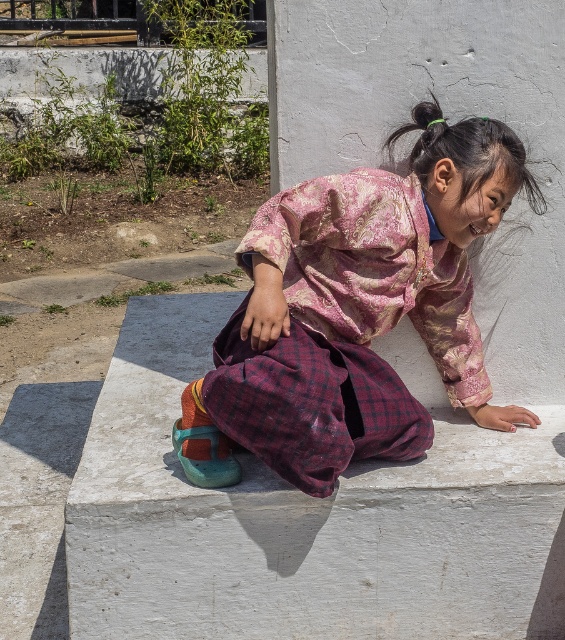
Does plaid fabric pants at center have a lesser width compared to white smooth concrete at center?

No, plaid fabric pants at center is not thinner than white smooth concrete at center.

Does plaid fabric pants at center have a greater height compared to white smooth concrete at center?

No.

Is point (224, 458) closer to viewer compared to point (475, 90)?

Yes, it is.

At what (x,y) coordinates should I click in order to perform the action: click on plaid fabric pants at center. Please return your answer as a coordinate pair (x, y). The width and height of the screenshot is (565, 640). Looking at the image, I should click on point(355,310).

Does white concrete at center appear on the left side of plaid fabric pants at center?

Yes, white concrete at center is to the left of plaid fabric pants at center.

Who is more forward, (459, 557) or (380, 244)?

Positioned in front is point (380, 244).

Looking at this image, measure the distance between white concrete at center and camera.

white concrete at center and camera are 9.00 feet apart from each other.

The image size is (565, 640). I want to click on white concrete at center, so click(302, 520).

Does white concrete at center appear over white smooth concrete at center?

Incorrect, white concrete at center is not positioned above white smooth concrete at center.

Is point (549, 522) in front of point (498, 355)?

Yes, it is.

Image resolution: width=565 pixels, height=640 pixels. What do you see at coordinates (302, 520) in the screenshot?
I see `white concrete at center` at bounding box center [302, 520].

This screenshot has height=640, width=565. In order to click on white concrete at center in this screenshot , I will do `click(302, 520)`.